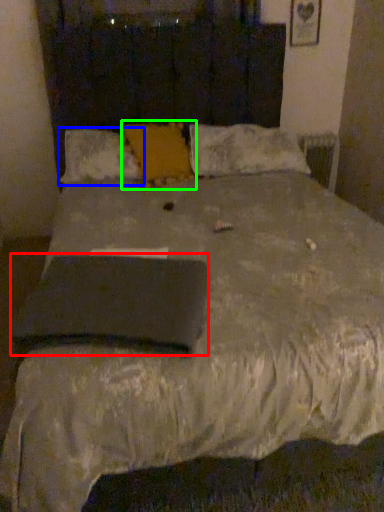
Question: Which object is positioned farthest from pad (highlighted by a red box)? Select from pillow (highlighted by a blue box) and pillow (highlighted by a green box).

Choices:
 (A) pillow
 (B) pillow

Answer: (B)